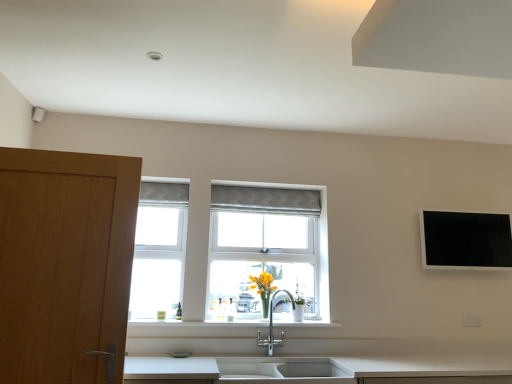
Question: Considering the relative sizes of white ceramic sink at lower center and white plastic electric outlet at lower right in the image provided, is white ceramic sink at lower center bigger than white plastic electric outlet at lower right?

Choices:
 (A) yes
 (B) no

Answer: (A)

Question: From the image's perspective, would you say white ceramic sink at lower center is positioned over white plastic electric outlet at lower right?

Choices:
 (A) yes
 (B) no

Answer: (B)

Question: Considering the relative positions of white ceramic sink at lower center and white plastic electric outlet at lower right in the image provided, is white ceramic sink at lower center to the right of white plastic electric outlet at lower right from the viewer's perspective?

Choices:
 (A) yes
 (B) no

Answer: (B)

Question: Is white ceramic sink at lower center positioned before white plastic electric outlet at lower right?

Choices:
 (A) yes
 (B) no

Answer: (A)

Question: From the image's perspective, is white ceramic sink at lower center under white plastic electric outlet at lower right?

Choices:
 (A) yes
 (B) no

Answer: (A)

Question: From a real-world perspective, is white ceramic sink at lower center positioned under white plastic electric outlet at lower right based on gravity?

Choices:
 (A) yes
 (B) no

Answer: (A)

Question: Can you confirm if white plastic electric outlet at lower right is thinner than white ceramic sink at lower center?

Choices:
 (A) no
 (B) yes

Answer: (B)

Question: Is white plastic electric outlet at lower right with white ceramic sink at lower center?

Choices:
 (A) no
 (B) yes

Answer: (A)

Question: Is white plastic electric outlet at lower right in front of white ceramic sink at lower center?

Choices:
 (A) yes
 (B) no

Answer: (B)

Question: Considering the relative sizes of white plastic electric outlet at lower right and white ceramic sink at lower center in the image provided, is white plastic electric outlet at lower right taller than white ceramic sink at lower center?

Choices:
 (A) no
 (B) yes

Answer: (A)

Question: From a real-world perspective, is white plastic electric outlet at lower right located beneath white ceramic sink at lower center?

Choices:
 (A) yes
 (B) no

Answer: (B)

Question: Considering the relative sizes of white plastic electric outlet at lower right and white ceramic sink at lower center in the image provided, is white plastic electric outlet at lower right shorter than white ceramic sink at lower center?

Choices:
 (A) yes
 (B) no

Answer: (A)

Question: Can you confirm if white plastic electric outlet at lower right is positioned to the left of textured gray curtain at center?

Choices:
 (A) no
 (B) yes

Answer: (A)